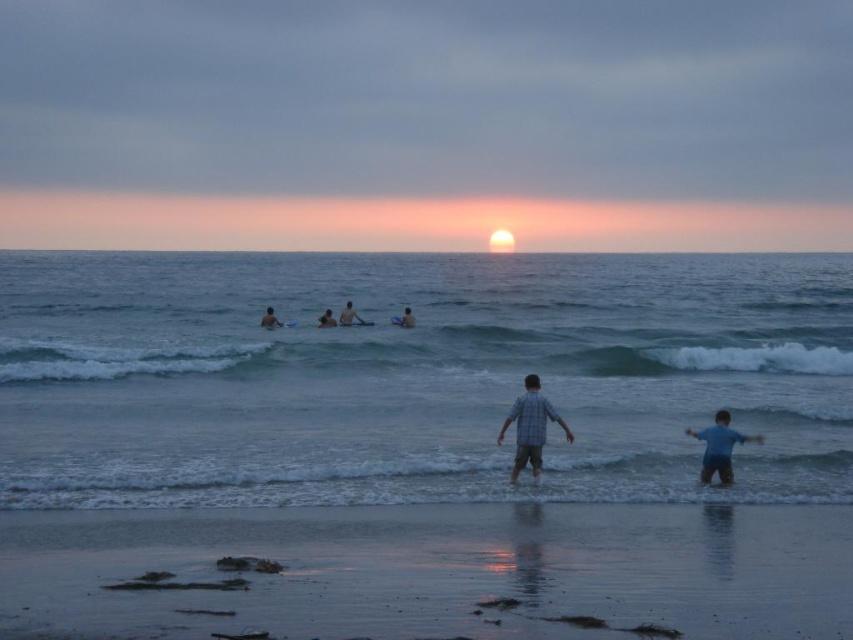
Question: Among these points, which one is farthest from the camera?

Choices:
 (A) (741, 371)
 (B) (543, 406)

Answer: (A)

Question: From the image, what is the correct spatial relationship of smooth sand at lower center in relation to white foamy wave at center?

Choices:
 (A) left
 (B) right

Answer: (A)

Question: Which point is farther to the camera?

Choices:
 (A) plaid shirt at center
 (B) clear blue water at center
 (C) blue cotton shirt at lower right
 (D) smooth sand at lower center

Answer: (C)

Question: Is clear blue water at center behind smooth tan skin at center?

Choices:
 (A) no
 (B) yes

Answer: (A)

Question: Can you confirm if white foamy wave at center is smaller than smooth tan skin at center?

Choices:
 (A) yes
 (B) no

Answer: (B)

Question: Among these objects, which one is nearest to the camera?

Choices:
 (A) smooth sand at lower center
 (B) white foamy wave at center

Answer: (A)